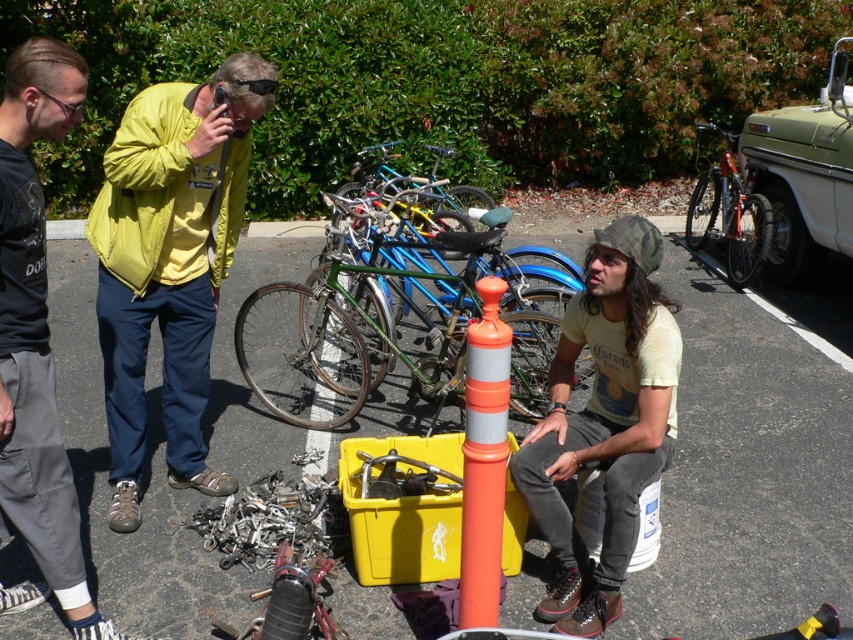
Which is below, shiny metallic bicycle at center or blue metallic bicycle at center?

Positioned lower is shiny metallic bicycle at center.

Which is in front, point (766, 243) or point (437, 211)?

Positioned in front is point (766, 243).

You are a GUI agent. You are given a task and a screenshot of the screen. Output one action in this format:
    pyautogui.click(x=<x>, y=<y>)
    Task: Click on the shiny metallic bicycle at center
    The width and height of the screenshot is (853, 640).
    Given the screenshot: What is the action you would take?
    729,214

Between green matte bicycle at center and blue metallic bicycle at center, which one has more height?

green matte bicycle at center is taller.

Which is more to the right, green matte bicycle at center or blue metallic bicycle at center?

Positioned to the right is blue metallic bicycle at center.

Is point (347, 348) positioned before point (442, 189)?

Yes, it is in front of point (442, 189).

Identify the location of green matte bicycle at center. The height and width of the screenshot is (640, 853). (392, 316).

Between point (221, 316) and point (338, 300), which one is positioned behind?

The point (221, 316) is behind.

The image size is (853, 640). I want to click on orange traffic cone at center, so click(x=747, y=474).

Is point (238, 294) positioned behind point (379, 269)?

That is True.

You are a GUI agent. You are given a task and a screenshot of the screen. Output one action in this format:
    pyautogui.click(x=<x>, y=<y>)
    Task: Click on the orange traffic cone at center
    This screenshot has height=640, width=853.
    Given the screenshot: What is the action you would take?
    pyautogui.click(x=747, y=474)